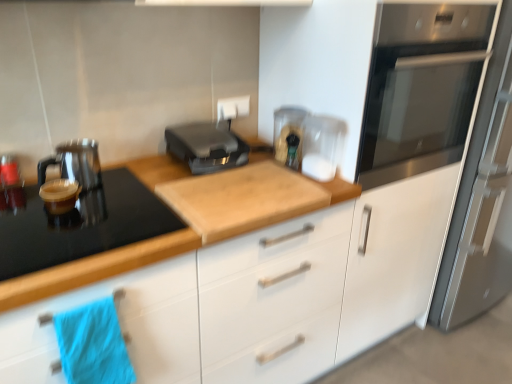
Question: From a real-world perspective, is blue fabric towel at lower left over wooden cutting board at center?

Choices:
 (A) yes
 (B) no

Answer: (A)

Question: Does blue fabric towel at lower left have a smaller size compared to wooden cutting board at center?

Choices:
 (A) no
 (B) yes

Answer: (B)

Question: Does blue fabric towel at lower left have a lesser height compared to wooden cutting board at center?

Choices:
 (A) yes
 (B) no

Answer: (A)

Question: From a real-world perspective, is blue fabric towel at lower left beneath wooden cutting board at center?

Choices:
 (A) no
 (B) yes

Answer: (A)

Question: Is blue fabric towel at lower left completely or partially outside of wooden cutting board at center?

Choices:
 (A) yes
 (B) no

Answer: (B)

Question: Considering the relative sizes of blue fabric towel at lower left and wooden cutting board at center in the image provided, is blue fabric towel at lower left bigger than wooden cutting board at center?

Choices:
 (A) no
 (B) yes

Answer: (A)

Question: Does matte black kettle at left, which is the 2th kitchen appliance in right-to-left order, turn towards black plastic toaster at center, the 1th kitchen appliance viewed from the right?

Choices:
 (A) yes
 (B) no

Answer: (B)

Question: Does matte black kettle at left, the 1th kitchen appliance when ordered from left to right, have a larger size compared to black plastic toaster at center, marked as the 2th kitchen appliance in a left-to-right arrangement?

Choices:
 (A) no
 (B) yes

Answer: (A)

Question: Is black plastic toaster at center, the 1th kitchen appliance viewed from the right, a part of matte black kettle at left, the 1th kitchen appliance when ordered from left to right?

Choices:
 (A) no
 (B) yes

Answer: (A)

Question: Considering the relative positions of matte black kettle at left, the 1th kitchen appliance when ordered from left to right, and black plastic toaster at center, the 1th kitchen appliance viewed from the right, in the image provided, is matte black kettle at left, the 1th kitchen appliance when ordered from left to right, to the right of black plastic toaster at center, the 1th kitchen appliance viewed from the right, from the viewer's perspective?

Choices:
 (A) no
 (B) yes

Answer: (A)

Question: Would you say matte black kettle at left, which is the 2th kitchen appliance in right-to-left order, is a long distance from black plastic toaster at center, the 1th kitchen appliance viewed from the right?

Choices:
 (A) no
 (B) yes

Answer: (A)

Question: From a real-world perspective, is matte black kettle at left, the 1th kitchen appliance when ordered from left to right, on top of black plastic toaster at center, the 1th kitchen appliance viewed from the right?

Choices:
 (A) yes
 (B) no

Answer: (B)

Question: Are wooden cutting board at center and stainless steel oven at upper right located far from each other?

Choices:
 (A) no
 (B) yes

Answer: (A)